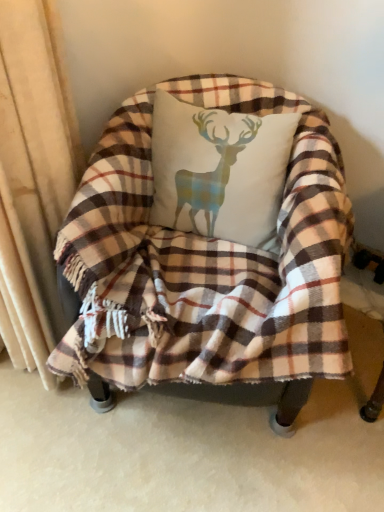
In order to face white cotton cushion with deer print at center, should I rotate leftwards or rightwards?

To align with it, rotate right about 3.005°.

What do you see at coordinates (219, 170) in the screenshot?
I see `white cotton cushion with deer print at center` at bounding box center [219, 170].

Where is `white cotton cushion with deer print at center`? The image size is (384, 512). white cotton cushion with deer print at center is located at coordinates (219, 170).

Locate an element on the screen. This screenshot has width=384, height=512. plaid fabric chair at center is located at coordinates (214, 256).

What do you see at coordinates (214, 256) in the screenshot?
I see `plaid fabric chair at center` at bounding box center [214, 256].

The height and width of the screenshot is (512, 384). I want to click on white cotton cushion with deer print at center, so click(219, 170).

Between plaid fabric chair at center and white cotton cushion with deer print at center, which one appears on the left side from the viewer's perspective?

From the viewer's perspective, plaid fabric chair at center appears more on the left side.

Does plaid fabric chair at center come behind white cotton cushion with deer print at center?

No, the depth of plaid fabric chair at center is less than that of white cotton cushion with deer print at center.

Is point (343, 245) farther from viewer compared to point (203, 196)?

No, it is in front of (203, 196).

From the image's perspective, which one is positioned lower, plaid fabric chair at center or white cotton cushion with deer print at center?

plaid fabric chair at center is shown below in the image.

From a real-world perspective, is plaid fabric chair at center beneath white cotton cushion with deer print at center?

Yes.

Which of these two, plaid fabric chair at center or white cotton cushion with deer print at center, is thinner?

With smaller width is white cotton cushion with deer print at center.

Does plaid fabric chair at center have a greater height compared to white cotton cushion with deer print at center?

Yes.

Between plaid fabric chair at center and white cotton cushion with deer print at center, which one has larger size?

Bigger between the two is plaid fabric chair at center.

Would you say white cotton cushion with deer print at center is part of plaid fabric chair at center's contents?

Yes, plaid fabric chair at center contains white cotton cushion with deer print at center.

Is plaid fabric chair at center not close to white cotton cushion with deer print at center?

No.

Is plaid fabric chair at center facing towards white cotton cushion with deer print at center?

Yes, plaid fabric chair at center is facing white cotton cushion with deer print at center.

The image size is (384, 512). In order to click on chair below the white cotton cushion with deer print at center (from the image's perspective) in this screenshot , I will do `click(214, 256)`.

Between white cotton cushion with deer print at center and plaid fabric chair at center, which one appears on the left side from the viewer's perspective?

From the viewer's perspective, plaid fabric chair at center appears more on the left side.

Which object is further away from the camera taking this photo, white cotton cushion with deer print at center or plaid fabric chair at center?

white cotton cushion with deer print at center is behind.

Does point (221, 209) come closer to viewer compared to point (134, 150)?

Yes, it is.

From the image's perspective, which is below, white cotton cushion with deer print at center or plaid fabric chair at center?

plaid fabric chair at center is shown below in the image.

From a real-world perspective, is white cotton cushion with deer print at center above or below plaid fabric chair at center?

white cotton cushion with deer print at center is situated higher than plaid fabric chair at center in the real world.

Does white cotton cushion with deer print at center have a greater width compared to plaid fabric chair at center?

Incorrect, the width of white cotton cushion with deer print at center does not surpass that of plaid fabric chair at center.

Can you confirm if white cotton cushion with deer print at center is taller than plaid fabric chair at center?

In fact, white cotton cushion with deer print at center may be shorter than plaid fabric chair at center.

Between white cotton cushion with deer print at center and plaid fabric chair at center, which one has larger size?

With larger size is plaid fabric chair at center.

Which is correct: white cotton cushion with deer print at center is inside plaid fabric chair at center, or outside of it?

white cotton cushion with deer print at center is enclosed within plaid fabric chair at center.

Is white cotton cushion with deer print at center far from plaid fabric chair at center?

white cotton cushion with deer print at center is actually quite close to plaid fabric chair at center.

Based on the photo, does white cotton cushion with deer print at center turn towards plaid fabric chair at center?

Yes.

At what (x,y) coordinates should I click in order to perform the action: click on throw pillow on the right of plaid fabric chair at center. Please return your answer as a coordinate pair (x, y). This screenshot has width=384, height=512. Looking at the image, I should click on (219, 170).

In order to click on chair below the white cotton cushion with deer print at center (from the image's perspective) in this screenshot , I will do `click(214, 256)`.

This screenshot has width=384, height=512. I want to click on throw pillow behind the plaid fabric chair at center, so click(219, 170).